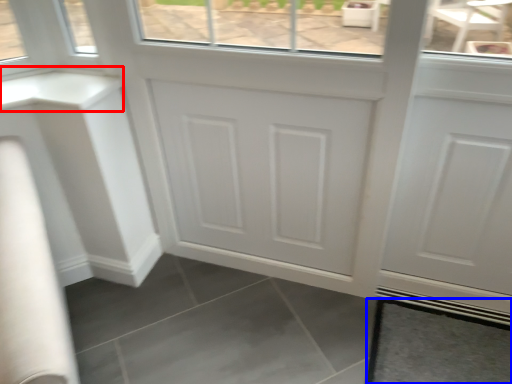
Question: Which of the following is the farthest to the observer, counter top (highlighted by a red box) or tile (highlighted by a blue box)?

Choices:
 (A) counter top
 (B) tile

Answer: (B)